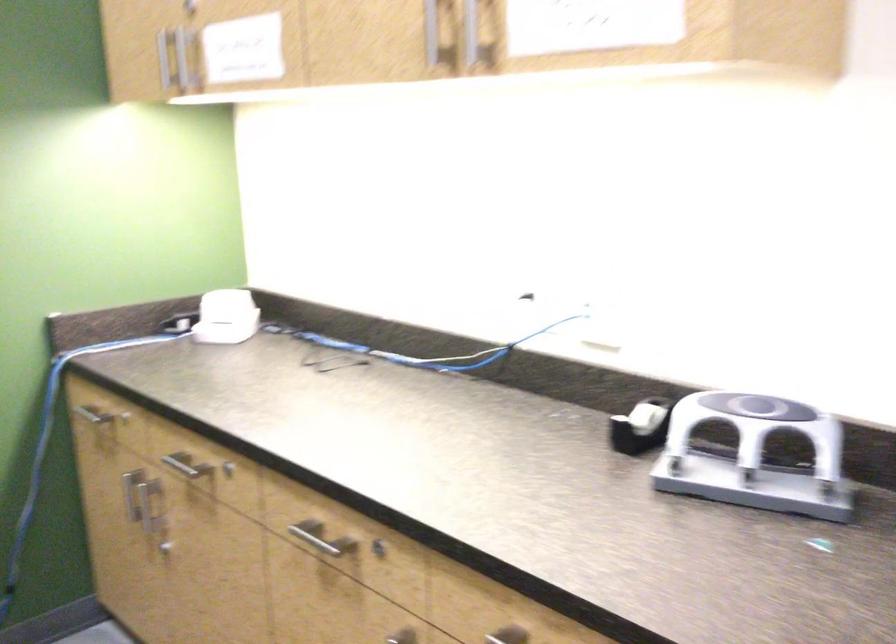
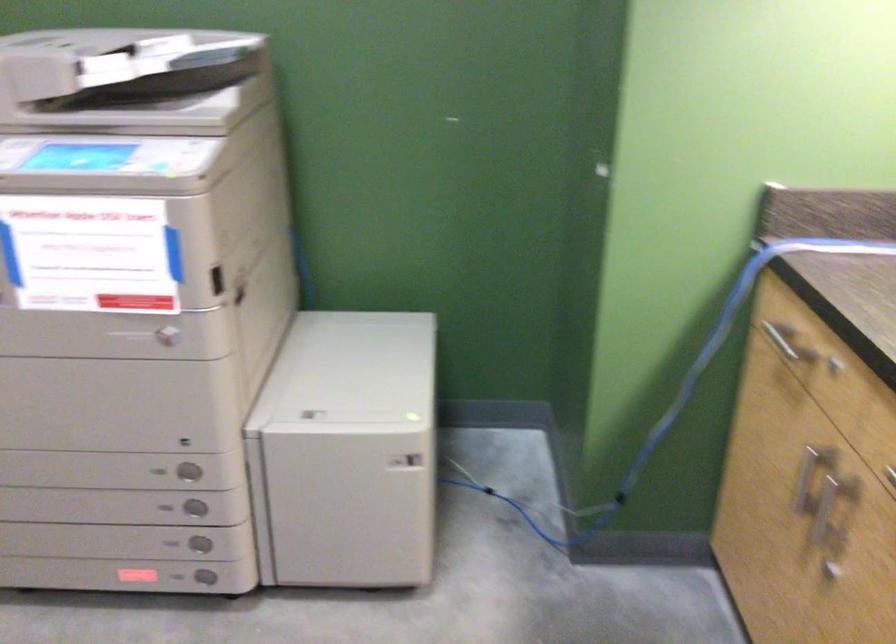
Question: How did the camera likely rotate?

Choices:
 (A) Left
 (B) Right
 (C) Up
 (D) Down

Answer: (A)